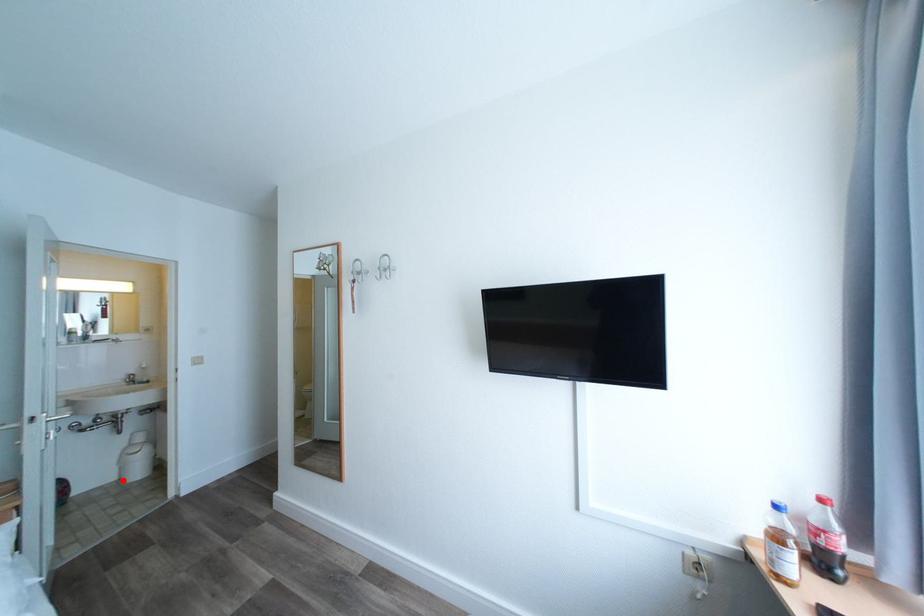
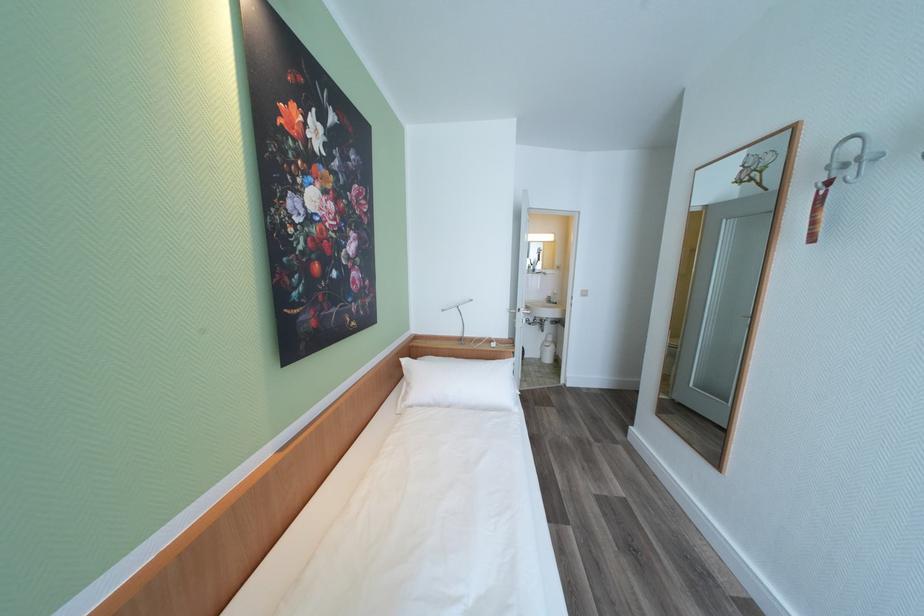
The point at the highlighted location is marked in the first image. Where is the corresponding point in the second image?

(546, 359)